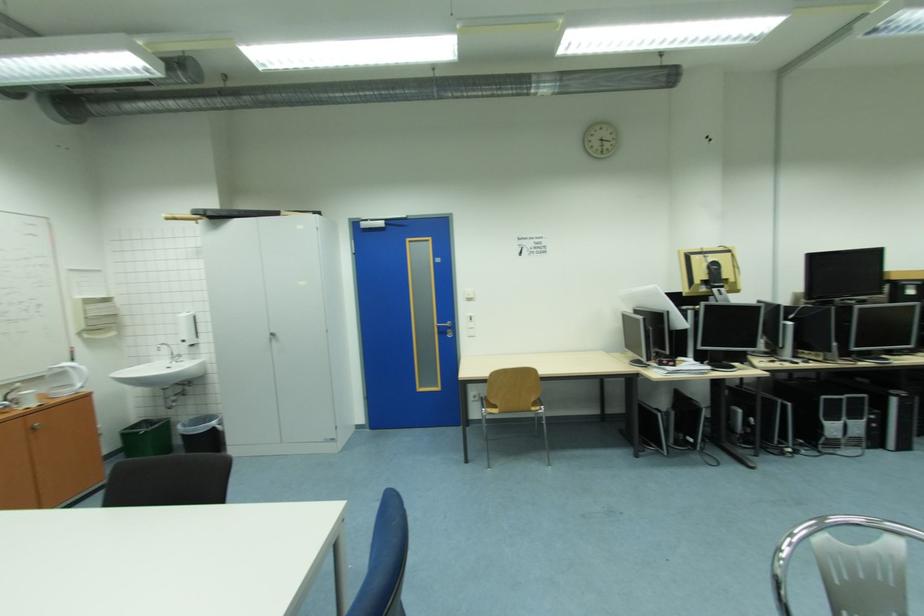
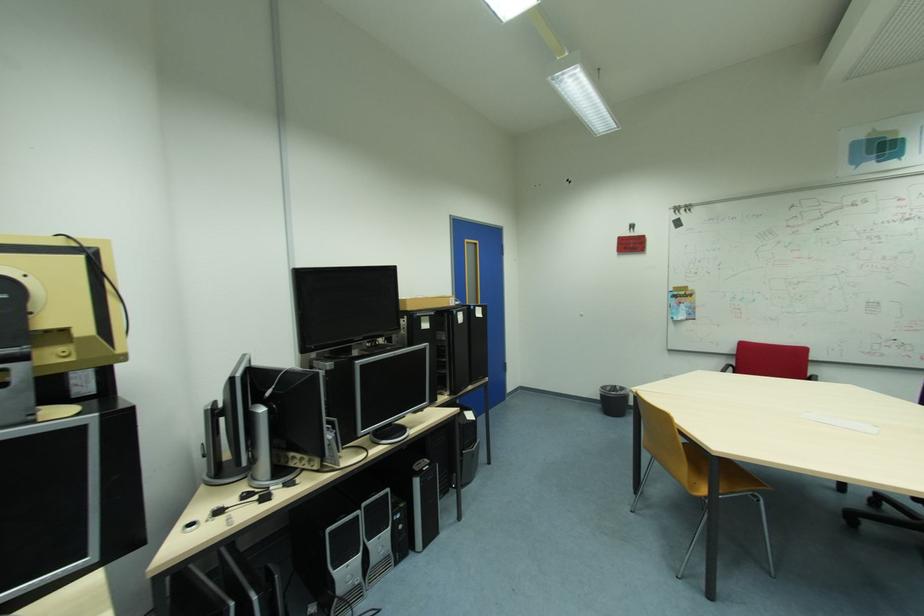
Locate, in the second image, the point that corresponds to point 849,400 in the first image.

(365, 517)